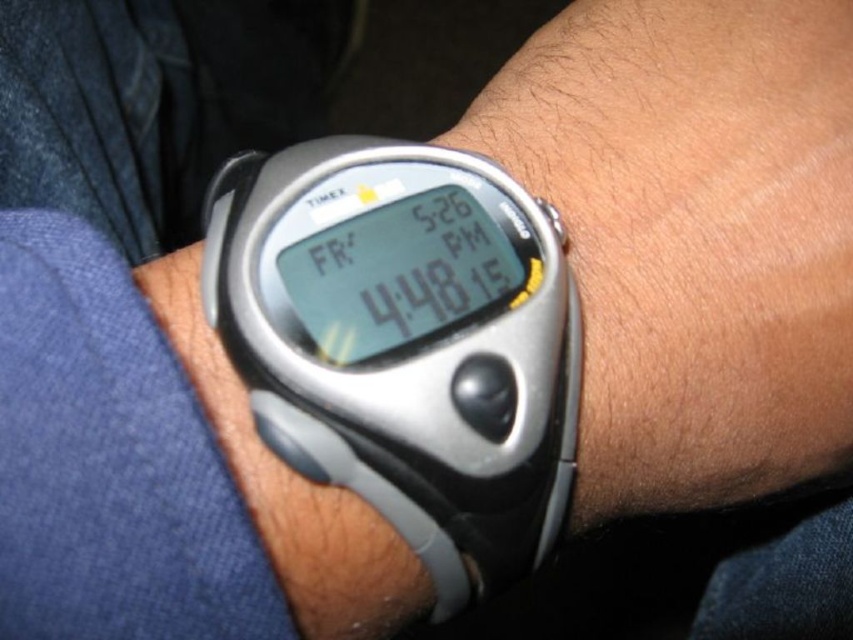
Question: Which of the following is the farthest from the observer?

Choices:
 (A) silver/black digital watch at center
 (B) silver/black plastic watch at center

Answer: (B)

Question: Does silver/black digital watch at center have a smaller size compared to silver/black plastic watch at center?

Choices:
 (A) no
 (B) yes

Answer: (A)

Question: Does silver/black digital watch at center have a greater width compared to silver/black plastic watch at center?

Choices:
 (A) yes
 (B) no

Answer: (A)

Question: Among these points, which one is farthest from the camera?

Choices:
 (A) (296, 577)
 (B) (276, 320)

Answer: (A)

Question: Does silver/black digital watch at center have a lesser width compared to silver/black plastic watch at center?

Choices:
 (A) yes
 (B) no

Answer: (B)

Question: Among these objects, which one is nearest to the camera?

Choices:
 (A) silver/black digital watch at center
 (B) silver/black plastic watch at center

Answer: (A)